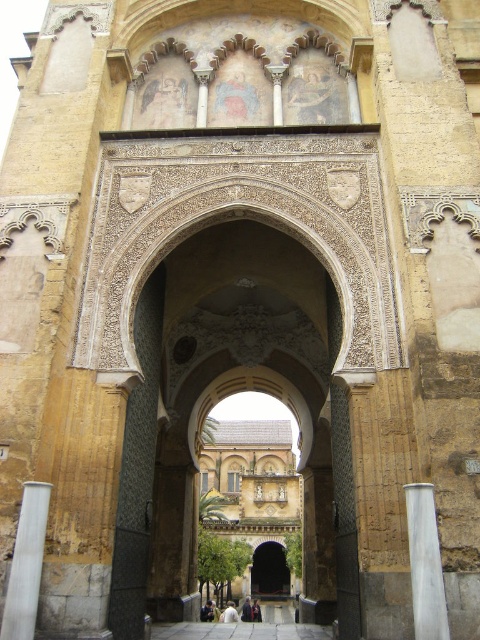
Does white marble pillar at center appear over dark brown wooden door at center?

Correct, white marble pillar at center is located above dark brown wooden door at center.

Looking at this image, does white marble pillar at center have a greater height compared to dark brown wooden door at center?

No.

Is point (421, 538) positioned before point (261, 566)?

Yes, it is.

Locate an element on the screen. The image size is (480, 640). white marble pillar at center is located at coordinates (424, 563).

Is white marble pillar at center above white stone pillar at lower left?

Yes.

Find the location of a particular element. Image resolution: width=480 pixels, height=640 pixels. white marble pillar at center is located at coordinates (424, 563).

What do you see at coordinates (424, 563) in the screenshot?
I see `white marble pillar at center` at bounding box center [424, 563].

Where is `white marble pillar at center`? This screenshot has width=480, height=640. white marble pillar at center is located at coordinates (424, 563).

What do you see at coordinates (25, 563) in the screenshot? This screenshot has height=640, width=480. I see `white stone pillar at lower left` at bounding box center [25, 563].

Does white stone pillar at lower left appear on the right side of dark brown wooden door at center?

Incorrect, white stone pillar at lower left is not on the right side of dark brown wooden door at center.

This screenshot has height=640, width=480. In order to click on white stone pillar at lower left in this screenshot , I will do tap(25, 563).

This screenshot has height=640, width=480. I want to click on white stone pillar at lower left, so click(x=25, y=563).